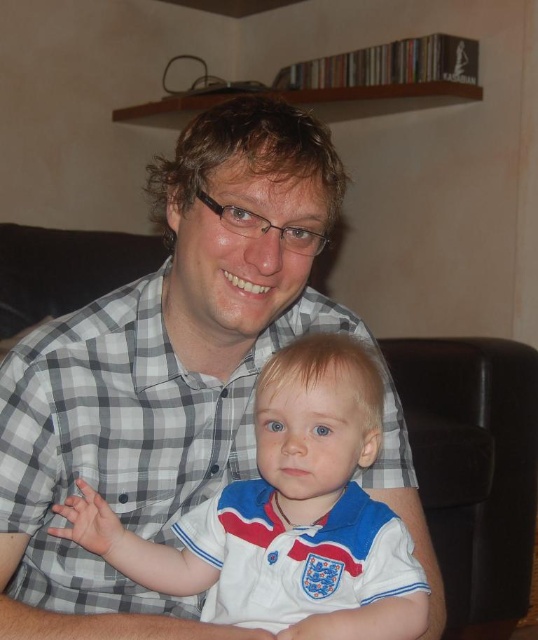
You are a photographer setting up for a family portrait. You notice two shirts in the scene, the checkered fabric shirt at center and the white cotton shirt at center. Which shirt should you adjust to ensure both are fully visible in the photo?

The white cotton shirt at center is behind the checkered fabric shirt at center, so you should adjust the white cotton shirt at center to move it forward so both shirts are visible.

You are a photographer setting up for a portrait. You have two subjects wearing the checkered fabric shirt at center and the white cotton shirt at center. The minimum distance required between subjects for your camera lens to focus properly is 5 inches. Based on the scene description, will the camera be able to focus on both subjects simultaneously?

The checkered fabric shirt at center is 4.70 inches from the white cotton shirt at center. Since the required minimum distance is 5 inches, the camera will not be able to focus on both subjects simultaneously because they are too close.

You are a photographer setting up a photo shoot. You have two subjects wearing the checkered fabric shirt at center and the white cotton shirt at center. You want to ensure the subjects are arranged so that the checkered shirt is on the left side of the white shirt. Is the current arrangement correct?

Yes, the current arrangement is correct because the checkered fabric shirt at center is positioned on the left side of the white cotton shirt at center as required.